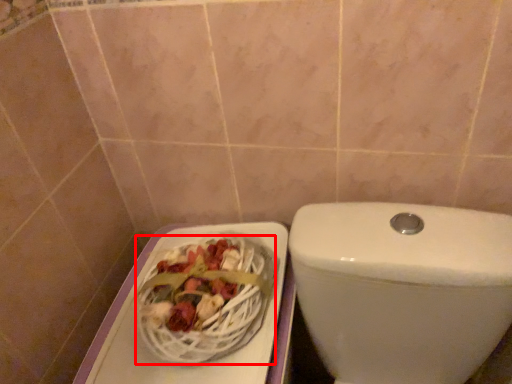
Question: From the image's perspective, where is basket (annotated by the red box) located in relation to toilet in the image?

Choices:
 (A) above
 (B) below

Answer: (A)